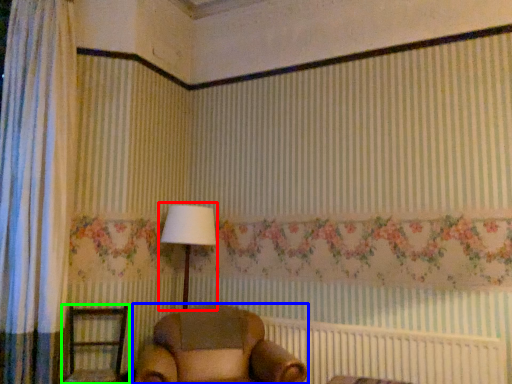
Question: Which object is the closest to the table lamp (highlighted by a red box)? Choose among these: furniture (highlighted by a blue box) or furniture (highlighted by a green box).

Choices:
 (A) furniture
 (B) furniture

Answer: (A)